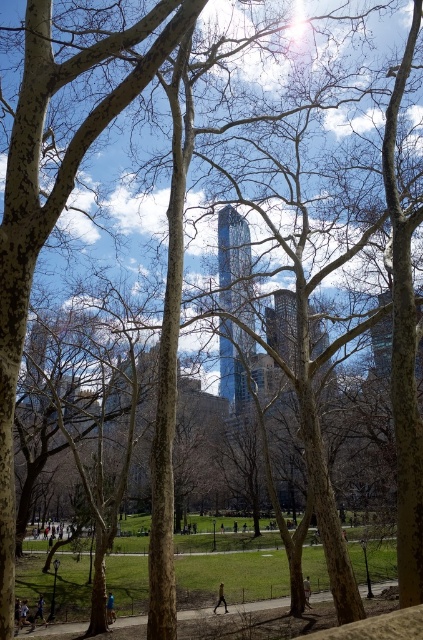
Question: Is light blue fabric at lower left smaller than light brown leather jacket at lower center?

Choices:
 (A) yes
 (B) no

Answer: (B)

Question: Estimate the real-world distances between objects in this image. Which object is closer to the dark gray jacket at center?

Choices:
 (A) light blue fabric at lower left
 (B) blue fabric person at lower left
 (C) smooth asphalt path at center
 (D) light brown leather jacket at lower center

Answer: (C)

Question: Does smooth asphalt path at center have a larger size compared to light blue fabric at lower left?

Choices:
 (A) yes
 (B) no

Answer: (A)

Question: Which of the following is the closest to the observer?

Choices:
 (A) dark gray jacket at center
 (B) light blue fabric at lower left

Answer: (B)

Question: Based on their relative distances, which object is farther from the light blue fabric at lower left?

Choices:
 (A) light brown leather jacket at lower center
 (B) blue fabric person at lower left

Answer: (A)

Question: Observing the image, what is the correct spatial positioning of blue fabric person at lower left in reference to light blue fabric at lower left?

Choices:
 (A) above
 (B) below

Answer: (A)